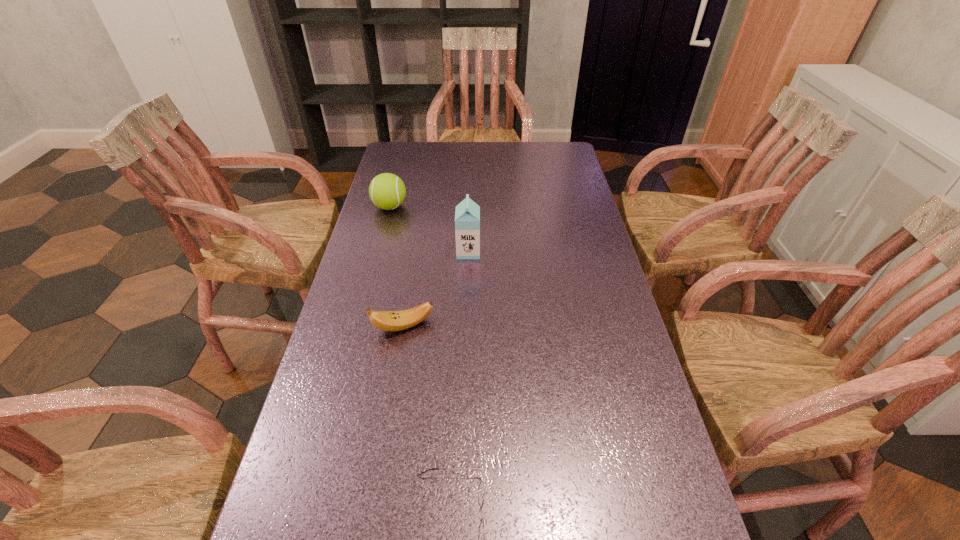
Where is `unoccupied position between the second farthest object and the second nearest object`? unoccupied position between the second farthest object and the second nearest object is located at coordinates (436, 289).

Where is `object that is the third closest to the third nearest object`? object that is the third closest to the third nearest object is located at coordinates (483, 510).

I want to click on object that stands as the closest to the shortest object, so click(384, 320).